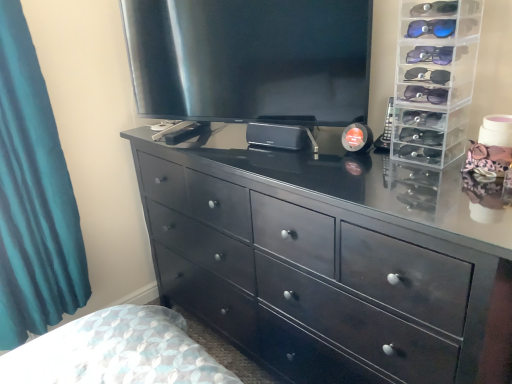
Where is `black wood chest of drawers at center`? The image size is (512, 384). black wood chest of drawers at center is located at coordinates (324, 257).

Locate an element on the screen. The image size is (512, 384). black wood chest of drawers at center is located at coordinates (324, 257).

Between satin black tv at upper center and teal fabric curtain at left, which one has more height?

With more height is teal fabric curtain at left.

Where is `curtain that is on the left side of satin black tv at upper center`? curtain that is on the left side of satin black tv at upper center is located at coordinates (33, 197).

Is satin black tv at upper center to the left of teal fabric curtain at left from the viewer's perspective?

Incorrect, satin black tv at upper center is not on the left side of teal fabric curtain at left.

Consider the image. From the image's perspective, is satin black tv at upper center located beneath teal fabric curtain at left?

Incorrect, from the image's perspective, satin black tv at upper center is higher than teal fabric curtain at left.

Which of these two, clear plastic sunglasses organizer at right or teal fabric curtain at left, is thinner?

teal fabric curtain at left.

Is teal fabric curtain at left at the back of clear plastic sunglasses organizer at right?

clear plastic sunglasses organizer at right does not have its back to teal fabric curtain at left.

Between clear plastic sunglasses organizer at right and teal fabric curtain at left, which one appears on the right side from the viewer's perspective?

clear plastic sunglasses organizer at right is more to the right.

In the scene shown: From the image's perspective, is clear plastic sunglasses organizer at right located above or below teal fabric curtain at left?

Based on their image positions, clear plastic sunglasses organizer at right is located above teal fabric curtain at left.

How different are the orientations of teal fabric curtain at left and clear plastic sunglasses organizer at right in degrees?

The angular difference between teal fabric curtain at left and clear plastic sunglasses organizer at right is 87.4 degrees.

Between teal fabric curtain at left and clear plastic sunglasses organizer at right, which one has smaller size?

clear plastic sunglasses organizer at right is smaller.

Considering their positions, is teal fabric curtain at left located in front of or behind clear plastic sunglasses organizer at right?

Visually, teal fabric curtain at left is located behind clear plastic sunglasses organizer at right.

Considering the sizes of objects teal fabric curtain at left and clear plastic sunglasses organizer at right in the image provided, who is wider, teal fabric curtain at left or clear plastic sunglasses organizer at right?

With larger width is clear plastic sunglasses organizer at right.

What's the angular difference between clear plastic sunglasses organizer at right and satin black tv at upper center's facing directions?

There is a 21.7-degree angle between the facing directions of clear plastic sunglasses organizer at right and satin black tv at upper center.

Considering the sizes of clear plastic sunglasses organizer at right and satin black tv at upper center in the image, is clear plastic sunglasses organizer at right bigger or smaller than satin black tv at upper center?

Considering their sizes, clear plastic sunglasses organizer at right takes up less space than satin black tv at upper center.

From a real-world perspective, which object rests below the other?

clear plastic sunglasses organizer at right, from a real-world perspective.

Considering the relative sizes of teal fabric curtain at left and black wood chest of drawers at center in the image provided, is teal fabric curtain at left smaller than black wood chest of drawers at center?

Indeed, teal fabric curtain at left has a smaller size compared to black wood chest of drawers at center.

Which object is further away from the camera taking this photo, teal fabric curtain at left or black wood chest of drawers at center?

Positioned behind is teal fabric curtain at left.

How many degrees apart are the facing directions of teal fabric curtain at left and black wood chest of drawers at center?

The angle between the facing direction of teal fabric curtain at left and the facing direction of black wood chest of drawers at center is 88.5 degrees.

Is teal fabric curtain at left oriented away from black wood chest of drawers at center?

teal fabric curtain at left is not turned away from black wood chest of drawers at center.

Measure the distance between black wood chest of drawers at center and satin black tv at upper center.

black wood chest of drawers at center is 17.30 inches from satin black tv at upper center.

The image size is (512, 384). In order to click on chest of drawers on the right of satin black tv at upper center in this screenshot , I will do `click(324, 257)`.

Between black wood chest of drawers at center and satin black tv at upper center, which one appears on the left side from the viewer's perspective?

From the viewer's perspective, satin black tv at upper center appears more on the left side.

Relative to satin black tv at upper center, is black wood chest of drawers at center in front or behind?

black wood chest of drawers at center is positioned closer to the viewer than satin black tv at upper center.

Based on the photo, from the image's perspective, would you say black wood chest of drawers at center is positioned over teal fabric curtain at left?

No, from the image's perspective, black wood chest of drawers at center is not on top of teal fabric curtain at left.

Is there a large distance between black wood chest of drawers at center and teal fabric curtain at left?

No, black wood chest of drawers at center is not far from teal fabric curtain at left.

Is point (485, 209) closer to viewer compared to point (7, 152)?

That is True.

From a real-world perspective, which object stands above the other?

teal fabric curtain at left, from a real-world perspective.

Identify the location of television to the right of teal fabric curtain at left. (250, 60).

At what (x,y) coordinates should I click in order to perform the action: click on curtain located behind the clear plastic sunglasses organizer at right. Please return your answer as a coordinate pair (x, y). This screenshot has width=512, height=384. Looking at the image, I should click on (33, 197).

When comparing their distances from clear plastic sunglasses organizer at right, does teal fabric curtain at left or satin black tv at upper center seem closer?

The object closer to clear plastic sunglasses organizer at right is satin black tv at upper center.

Based on their spatial positions, is teal fabric curtain at left or black wood chest of drawers at center closer to satin black tv at upper center?

black wood chest of drawers at center is positioned closer to the anchor satin black tv at upper center.

From the image, which object appears to be farther from black wood chest of drawers at center, satin black tv at upper center or clear plastic sunglasses organizer at right?

clear plastic sunglasses organizer at right.

From the image, which object appears to be nearer to satin black tv at upper center, teal fabric curtain at left or clear plastic sunglasses organizer at right?

Based on the image, clear plastic sunglasses organizer at right appears to be nearer to satin black tv at upper center.

From the image, which object appears to be farther from teal fabric curtain at left, clear plastic sunglasses organizer at right or satin black tv at upper center?

clear plastic sunglasses organizer at right is further to teal fabric curtain at left.

From the image, which object appears to be nearer to teal fabric curtain at left, clear plastic sunglasses organizer at right or black wood chest of drawers at center?

Based on the image, black wood chest of drawers at center appears to be nearer to teal fabric curtain at left.

From the image, which object appears to be nearer to clear plastic sunglasses organizer at right, satin black tv at upper center or teal fabric curtain at left?

satin black tv at upper center is positioned closer to the anchor clear plastic sunglasses organizer at right.

When comparing their distances from teal fabric curtain at left, does satin black tv at upper center or clear plastic sunglasses organizer at right seem closer?

satin black tv at upper center lies closer to teal fabric curtain at left than the other object.

Identify the location of television located between teal fabric curtain at left and black wood chest of drawers at center in the left-right direction. Image resolution: width=512 pixels, height=384 pixels. (250, 60).

Image resolution: width=512 pixels, height=384 pixels. What are the coordinates of `the chest of drawers situated between teal fabric curtain at left and clear plastic sunglasses organizer at right from left to right` in the screenshot? It's located at (324, 257).

In order to click on tv cabinet between satin black tv at upper center and black wood chest of drawers at center in the up-down direction in this screenshot , I will do `click(434, 79)`.

At what (x,y) coordinates should I click in order to perform the action: click on television between teal fabric curtain at left and clear plastic sunglasses organizer at right from left to right. Please return your answer as a coordinate pair (x, y). Looking at the image, I should click on (250, 60).